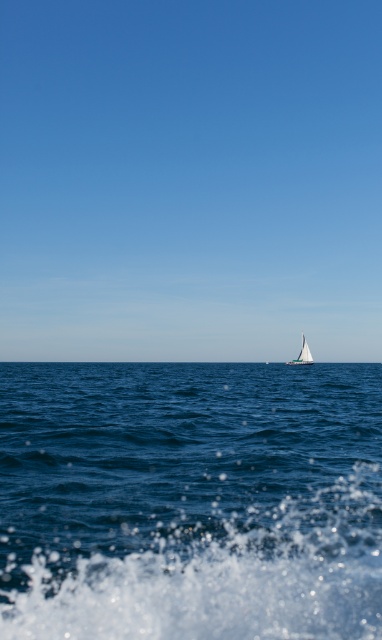
You are standing at the center of the image. Which direction should you move to reach the blue liquid water at lower center?

The blue liquid water at lower center is located at point coordinates of (x=189, y=500). Since you are at the center, you should move to the right and slightly downward to reach it.

You are standing on a cliff overlooking the seascape. You notice the blue liquid water at lower center and the white sailboat at center. Which object appears wider from your viewpoint?

The blue liquid water at lower center appears wider than the white sailboat at center because its width surpasses the sailboat.